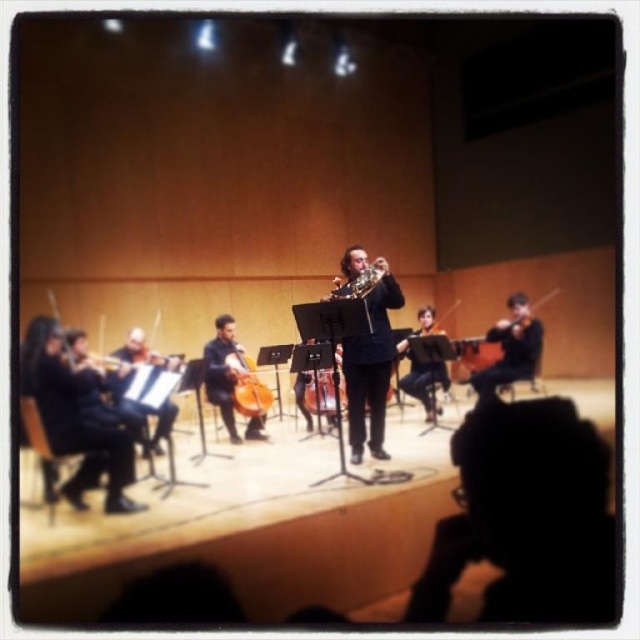
You are a stagehand adjusting the lighting for the performance. You need to ensure that the black matte violin at left and the shiny brass trumpet at center are both well lit. Since the violin is below the trumpet, where should you position the light to best illuminate both instruments?

The black matte violin at left is located below the shiny brass trumpet at center. To best illuminate both instruments, position the light above and slightly forward of the shiny brass trumpet at center so that it can cast light downward onto both the trumpet and the violin below it.

You are a stagehand who needs to place a new spotlight on the stage. You have two points marked on the stage floor plan for possible placement. The first point is labeled as point (33, 385) and the second is point (376, 280). According to the scene description, which point is closer to the audience? Please explain your reasoning.

Point (33, 385) is closer to the audience because it is in front of point (376, 280). In stage coordinates, lower y values are closer to the audience.